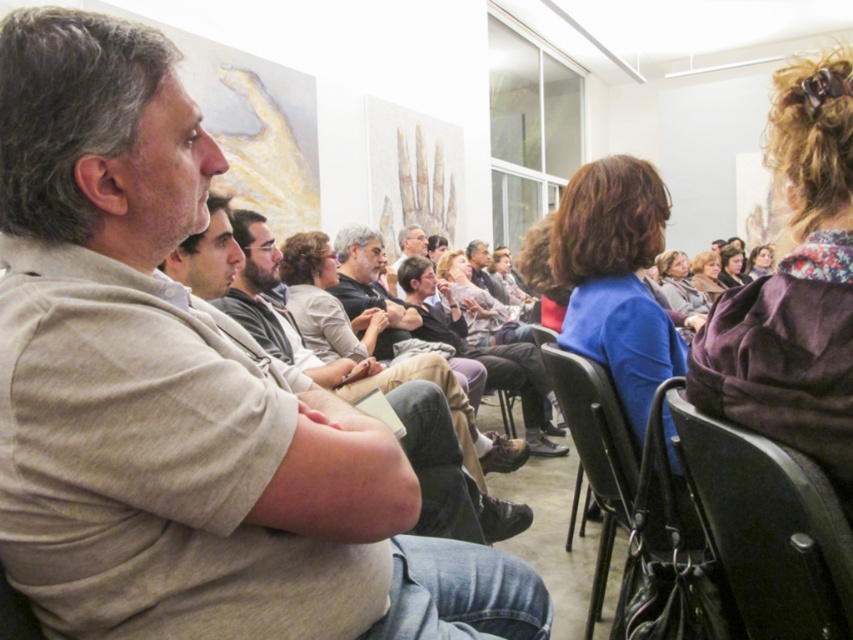
In the scene shown: You are a person who is 1.8 meters tall and want to see the speaker clearly. You are currently sitting in the blue fabric jacket at center. The matte blue shirt at center is blocking your view. Can you move to a seat that allows you to see the speaker without obstruction?

The distance between the blue fabric jacket at center and the matte blue shirt at center is 3.95 meters. Since the obstruction is 3.95 meters away, you can move to a seat behind the matte blue shirt at center to have an unobstructed view of the speaker.

You are standing at the entrance of the room and see the light brown cotton shirt at center. If you walk straight towards it, will you reach it before reaching the front row of chairs?

The light brown cotton shirt at center is located at point 0.703 on the x axis and 0.509 on the y axis. Since the front row of chairs is closer to the entrance, you will reach the front row of chairs before reaching the light brown cotton shirt at center.

You are standing at the point with coordinates (433, 449) in the image. What is the color of the clothing item you are currently standing on?

The point at (433, 449) is on a light brown cotton shirt at center, so the color is light brown.